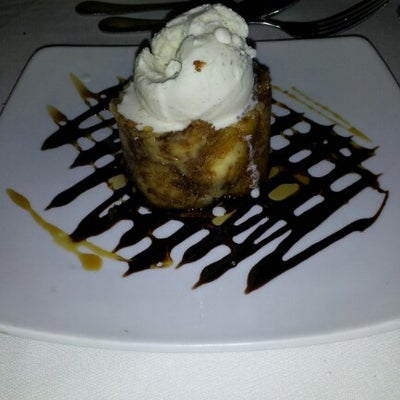
Find the location of a particular element. The width and height of the screenshot is (400, 400). table in front of plate is located at coordinates (86, 30).